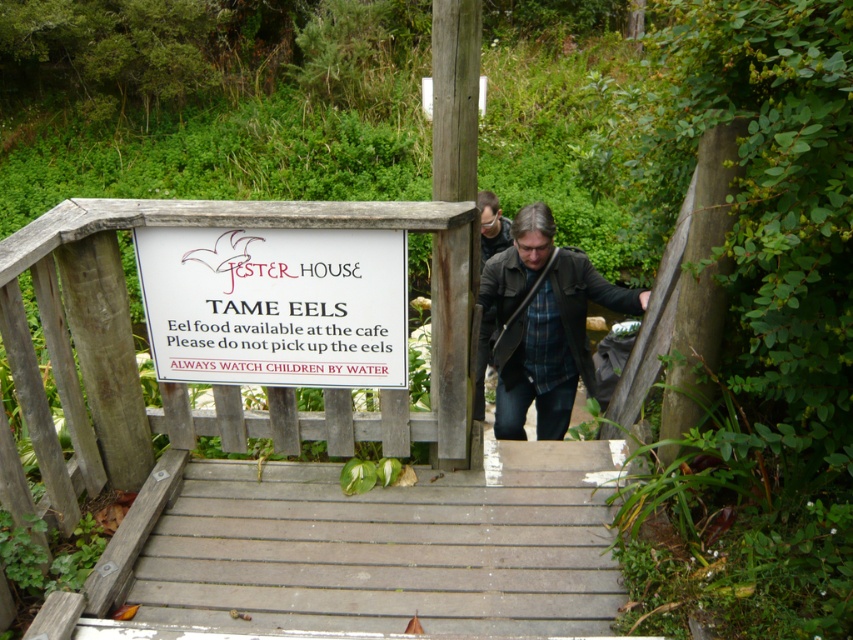
You are standing at the point labeled point (509, 264) and want to walk towards the point labeled point (190, 328). Which direction should you move?

You should move forward because point (190, 328) is in front of point (509, 264).

You are a visitor at the park and see the white paper sign at upper center and the dark brown leather jacket at center. According to the scene, which object is positioned to the left when facing the image?

The white paper sign at upper center is to the left of the dark brown leather jacket at center.